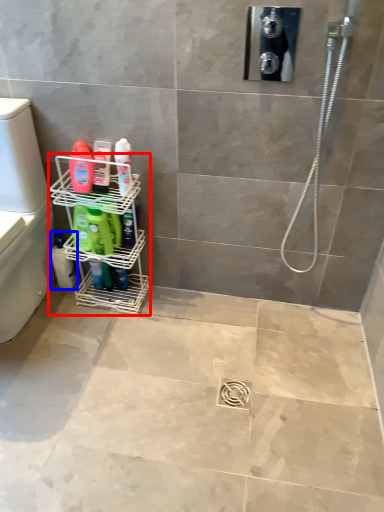
Question: Which point is closer to the camera, shelf (highlighted by a red box) or cleaning product (highlighted by a blue box)?

Choices:
 (A) shelf
 (B) cleaning product

Answer: (A)